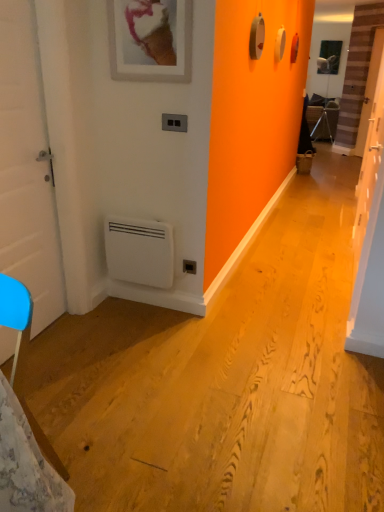
In order to face black plastic/light switch at upper center, should I rotate leftwards or rightwards?

Turn left by 2.593 degrees to look at black plastic/light switch at upper center.

What is the approximate width of white plastic air conditioning unit at lower left?

white plastic air conditioning unit at lower left is 10.50 centimeters wide.

Locate an element on the screen. This screenshot has height=512, width=384. white matte door at left, which is counted as the 2th door, starting from the right is located at coordinates (27, 169).

What do you see at coordinates (189, 267) in the screenshot? I see `black plastic electric outlet at lower center` at bounding box center [189, 267].

The height and width of the screenshot is (512, 384). Identify the location of white glossy door at right, placed as the first door when sorted from right to left. (370, 228).

Image resolution: width=384 pixels, height=512 pixels. I want to click on black plastic/light switch at upper center, so click(x=174, y=122).

At what (x,y) coordinates should I click in order to perform the action: click on picture frame that appears in front of the black plastic electric outlet at lower center. Please return your answer as a coordinate pair (x, y). The width and height of the screenshot is (384, 512). Looking at the image, I should click on (150, 39).

Considering the positions of point (147, 4) and point (184, 260), is point (147, 4) closer or farther from the camera than point (184, 260)?

Point (147, 4).

Is matte white picture frame at upper center touching black plastic electric outlet at lower center?

No, matte white picture frame at upper center is not touching black plastic electric outlet at lower center.

Based on the photo, considering the positions of objects matte white picture frame at upper center and black plastic electric outlet at lower center in the image provided, who is behind, matte white picture frame at upper center or black plastic electric outlet at lower center?

black plastic electric outlet at lower center is further away from the camera.

Is there a large distance between black plastic/light switch at upper center and matte white picture frame at upper center?

No, black plastic/light switch at upper center is not far away from matte white picture frame at upper center.

From the image's perspective, is black plastic/light switch at upper center located above matte white picture frame at upper center?

No, from the image's perspective, black plastic/light switch at upper center is not above matte white picture frame at upper center.

Looking at this image, which is more to the right, black plastic/light switch at upper center or matte white picture frame at upper center?

black plastic/light switch at upper center.

Does black plastic/light switch at upper center have a greater height compared to matte white picture frame at upper center?

In fact, black plastic/light switch at upper center may be shorter than matte white picture frame at upper center.

From a real-world perspective, relative to matte white picture frame at upper center, is white plastic air conditioning unit at lower left vertically above or below?

white plastic air conditioning unit at lower left is situated lower than matte white picture frame at upper center in the real world.

Is white plastic air conditioning unit at lower left with matte white picture frame at upper center?

No, white plastic air conditioning unit at lower left is not with matte white picture frame at upper center.

Which object is wider, white plastic air conditioning unit at lower left or matte white picture frame at upper center?

white plastic air conditioning unit at lower left is wider.

Is white glossy door at right, placed as the first door when sorted from right to left, at the right side of white matte door at left, acting as the first door starting from the left?

Correct, you'll find white glossy door at right, placed as the first door when sorted from right to left, to the right of white matte door at left, acting as the first door starting from the left.

From the image's perspective, which is below, white glossy door at right, placed as the first door when sorted from right to left, or white matte door at left, acting as the first door starting from the left?

white matte door at left, acting as the first door starting from the left, from the image's perspective.

Would you consider white glossy door at right, which is the 2th door in left-to-right order, to be distant from white matte door at left, acting as the first door starting from the left?

That's right, there is a large distance between white glossy door at right, which is the 2th door in left-to-right order, and white matte door at left, acting as the first door starting from the left.

Can you tell me how much white glossy door at right, placed as the first door when sorted from right to left, and white matte door at left, acting as the first door starting from the left, differ in facing direction?

There is a 180-degree angle between the facing directions of white glossy door at right, placed as the first door when sorted from right to left, and white matte door at left, acting as the first door starting from the left.

Does black plastic electric outlet at lower center lie behind white matte door at left, acting as the first door starting from the left?

Yes, black plastic electric outlet at lower center is behind white matte door at left, acting as the first door starting from the left.

From the image's perspective, would you say black plastic electric outlet at lower center is positioned over white matte door at left, which is counted as the 2th door, starting from the right?

No, from the image's perspective, black plastic electric outlet at lower center is not on top of white matte door at left, which is counted as the 2th door, starting from the right.

Is point (183, 260) farther from viewer compared to point (30, 73)?

Yes, it is.

Is the position of white matte door at left, which is counted as the 2th door, starting from the right, less distant than that of white glossy door at right, placed as the first door when sorted from right to left?

Yes.

Is point (37, 224) positioned before point (375, 293)?

Yes, it is in front of point (375, 293).

Can we say white matte door at left, which is counted as the 2th door, starting from the right, lies outside white glossy door at right, placed as the first door when sorted from right to left?

Absolutely, white matte door at left, which is counted as the 2th door, starting from the right, is external to white glossy door at right, placed as the first door when sorted from right to left.

From the image's perspective, is white matte door at left, acting as the first door starting from the left, positioned above or below white glossy door at right, placed as the first door when sorted from right to left?

white matte door at left, acting as the first door starting from the left, is below white glossy door at right, placed as the first door when sorted from right to left.

Could you measure the distance between white matte door at left, acting as the first door starting from the left, and matte white picture frame at upper center?

white matte door at left, acting as the first door starting from the left, is 25.42 inches from matte white picture frame at upper center.

Can you confirm if white matte door at left, which is counted as the 2th door, starting from the right, is taller than matte white picture frame at upper center?

Correct, white matte door at left, which is counted as the 2th door, starting from the right, is much taller as matte white picture frame at upper center.

Is white matte door at left, acting as the first door starting from the left, looking in the opposite direction of matte white picture frame at upper center?

No, matte white picture frame at upper center is not at the back of white matte door at left, acting as the first door starting from the left.

Based on the photo, can you tell me how much white matte door at left, which is counted as the 2th door, starting from the right, and matte white picture frame at upper center differ in facing direction?

white matte door at left, which is counted as the 2th door, starting from the right, and matte white picture frame at upper center are facing 89.7 degrees away from each other.

The image size is (384, 512). In the image, there is a matte white picture frame at upper center. In order to click on electric outlet below it (from the image's perspective) in this screenshot , I will do `click(189, 267)`.

Find the location of `picture frame on the left of black plastic/light switch at upper center`. picture frame on the left of black plastic/light switch at upper center is located at coordinates (150, 39).

Which object lies nearer to the anchor point black plastic electric outlet at lower center, white matte door at left, acting as the first door starting from the left, or black plastic/light switch at upper center?

black plastic/light switch at upper center is closer to black plastic electric outlet at lower center.

Considering their positions, is matte white picture frame at upper center positioned closer to white glossy door at right, which is the 2th door in left-to-right order, than white matte door at left, which is counted as the 2th door, starting from the right?

matte white picture frame at upper center.

From the image, which object appears to be nearer to white glossy door at right, placed as the first door when sorted from right to left, white matte door at left, acting as the first door starting from the left, or black plastic/light switch at upper center?

black plastic/light switch at upper center is closer to white glossy door at right, placed as the first door when sorted from right to left.

Looking at the image, which one is located further to white glossy door at right, which is the 2th door in left-to-right order, white plastic air conditioning unit at lower left or matte white picture frame at upper center?

matte white picture frame at upper center is positioned further to the anchor white glossy door at right, which is the 2th door in left-to-right order.

Looking at the image, which one is located further to white matte door at left, acting as the first door starting from the left, black plastic/light switch at upper center or matte white picture frame at upper center?

black plastic/light switch at upper center is positioned further to the anchor white matte door at left, acting as the first door starting from the left.

From the image, which object appears to be nearer to black plastic electric outlet at lower center, white glossy door at right, which is the 2th door in left-to-right order, or black plastic/light switch at upper center?

Among the two, black plastic/light switch at upper center is located nearer to black plastic electric outlet at lower center.

When comparing their distances from white plastic air conditioning unit at lower left, does matte white picture frame at upper center or black plastic/light switch at upper center seem closer?

black plastic/light switch at upper center.

Based on their spatial positions, is white plastic air conditioning unit at lower left or black plastic electric outlet at lower center closer to white glossy door at right, which is the 2th door in left-to-right order?

The object closer to white glossy door at right, which is the 2th door in left-to-right order, is black plastic electric outlet at lower center.

The height and width of the screenshot is (512, 384). In order to click on air conditioning between white matte door at left, which is counted as the 2th door, starting from the right, and black plastic electric outlet at lower center from front to back in this screenshot , I will do `click(140, 251)`.

At what (x,y) coordinates should I click in order to perform the action: click on light switch located between white plastic air conditioning unit at lower left and white glossy door at right, which is the 2th door in left-to-right order, in the left-right direction. Please return your answer as a coordinate pair (x, y). Looking at the image, I should click on (174, 122).

Image resolution: width=384 pixels, height=512 pixels. Find the location of `light switch between white matte door at left, acting as the first door starting from the left, and black plastic electric outlet at lower center in the front-back direction`. light switch between white matte door at left, acting as the first door starting from the left, and black plastic electric outlet at lower center in the front-back direction is located at coordinates (174, 122).

Locate an element on the screen. This screenshot has height=512, width=384. electric outlet between white plastic air conditioning unit at lower left and white glossy door at right, placed as the first door when sorted from right to left is located at coordinates (189, 267).